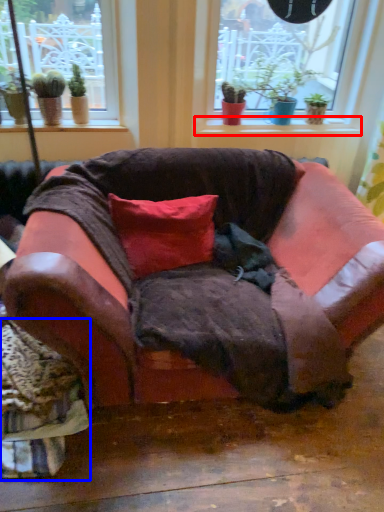
Question: Which of the following is the farthest to the observer, window sill (highlighted by a red box) or swivel chair (highlighted by a blue box)?

Choices:
 (A) window sill
 (B) swivel chair

Answer: (A)